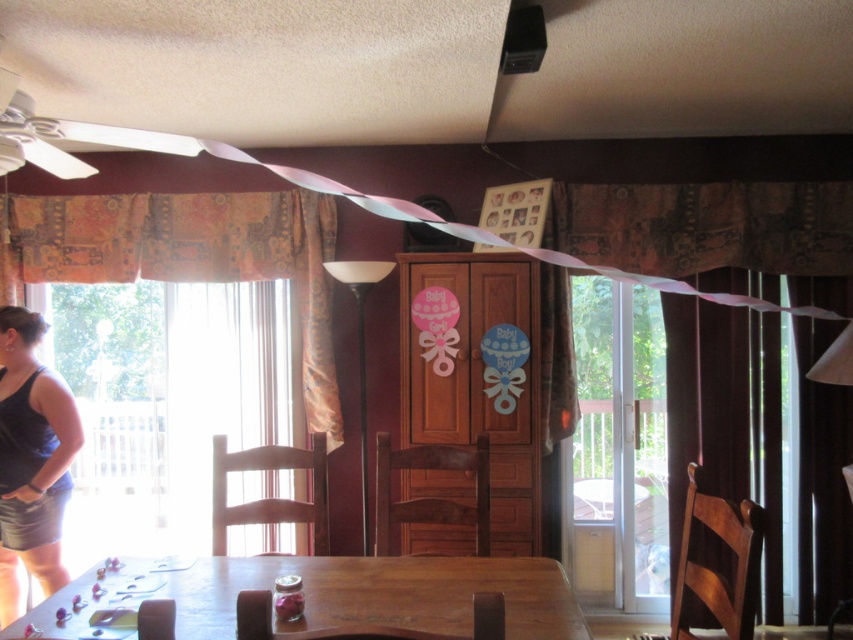
From the picture: Does patterned fabric curtain at left have a lesser width compared to wooden table at lower center?

Incorrect, patterned fabric curtain at left's width is not less than wooden table at lower center's.

Between point (210, 248) and point (428, 579), which one is positioned behind?

The point (210, 248) is more distant.

Identify the location of patterned fabric curtain at left. This screenshot has width=853, height=640. (187, 257).

Which is in front, point (3, 257) or point (45, 502)?

Point (45, 502) is more forward.

Locate an element on the screen. The height and width of the screenshot is (640, 853). patterned fabric curtain at left is located at coordinates (187, 257).

Can you confirm if wooden table at lower center is positioned to the left of black fabric at left?

In fact, wooden table at lower center is to the right of black fabric at left.

Can you confirm if wooden table at lower center is wider than black fabric at left?

Yes, wooden table at lower center is wider than black fabric at left.

Where is `wooden table at lower center`? The image size is (853, 640). wooden table at lower center is located at coordinates (344, 595).